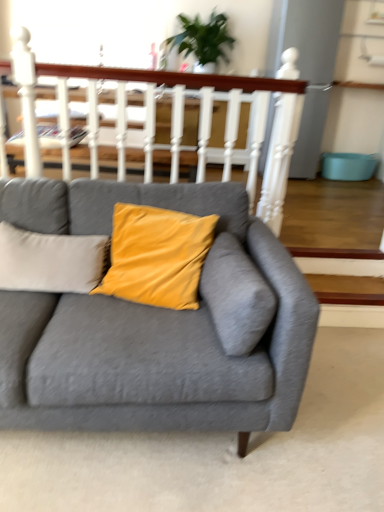
Describe the element at coordinates (149, 330) in the screenshot. I see `matte gray couch at center` at that location.

Describe the element at coordinates (51, 261) in the screenshot. I see `velvet yellow pillow at center` at that location.

In order to click on green leafy plant at upper center in this screenshot , I will do `click(203, 40)`.

This screenshot has width=384, height=512. Find the location of `matte gray couch at center`. matte gray couch at center is located at coordinates (149, 330).

Identify the location of studio couch located on the left of green leafy plant at upper center. (149, 330).

Would you say green leafy plant at upper center is outside matte gray couch at center?

Yes.

Which of these two, green leafy plant at upper center or matte gray couch at center, stands shorter?

green leafy plant at upper center.

From a real-world perspective, which object rests below the other?

matte gray couch at center, from a real-world perspective.

Is point (64, 276) behind point (218, 93)?

That is False.

Consider the image. Is velvet yellow pillow at center far from white wooden balustrade at upper center?

No, velvet yellow pillow at center is not far from white wooden balustrade at upper center.

Does velvet yellow pillow at center appear on the right side of white wooden balustrade at upper center?

Incorrect, velvet yellow pillow at center is not on the right side of white wooden balustrade at upper center.

Considering the positions of point (232, 425) and point (19, 52), is point (232, 425) closer or farther from the camera than point (19, 52)?

Point (232, 425).

Who is bigger, matte gray couch at center or white wooden balustrade at upper center?

matte gray couch at center is bigger.

Could you tell me if matte gray couch at center is facing white wooden balustrade at upper center?

No, matte gray couch at center is not oriented towards white wooden balustrade at upper center.

Does matte gray couch at center appear on the right side of white wooden balustrade at upper center?

Incorrect, matte gray couch at center is not on the right side of white wooden balustrade at upper center.

Is white wooden balustrade at upper center at the back of green leafy plant at upper center?

No, green leafy plant at upper center's orientation is not away from white wooden balustrade at upper center.

What's the angular difference between green leafy plant at upper center and white wooden balustrade at upper center's facing directions?

green leafy plant at upper center and white wooden balustrade at upper center are facing 179 degrees away from each other.

Looking at their sizes, would you say green leafy plant at upper center is wider or thinner than white wooden balustrade at upper center?

In the image, green leafy plant at upper center appears to be wider than white wooden balustrade at upper center.

Considering the relative sizes of matte gray couch at center and velvet yellow pillow at center in the image provided, is matte gray couch at center taller than velvet yellow pillow at center?

Correct, matte gray couch at center is much taller as velvet yellow pillow at center.

From a real-world perspective, between matte gray couch at center and velvet yellow pillow at center, who is vertically lower?

In real-world perspective, matte gray couch at center is lower.

Based on the photo, is matte gray couch at center beside velvet yellow pillow at center?

matte gray couch at center and velvet yellow pillow at center are clearly separated.

In the scene shown: Between matte gray couch at center and velvet yellow pillow at center, which one has larger width?

Wider between the two is matte gray couch at center.

Do you think velvet yellow pillow at center is within matte gray couch at center, or outside of it?

velvet yellow pillow at center exists entirely within matte gray couch at center.

Considering the positions of objects velvet yellow pillow at center and matte gray couch at center in the image provided, who is more to the left, velvet yellow pillow at center or matte gray couch at center?

velvet yellow pillow at center.

Is white wooden balustrade at upper center positioned with its back to velvet yellow pillow at center?

Absolutely, white wooden balustrade at upper center is directed away from velvet yellow pillow at center.

Considering the positions of objects white wooden balustrade at upper center and velvet yellow pillow at center in the image provided, who is behind, white wooden balustrade at upper center or velvet yellow pillow at center?

white wooden balustrade at upper center is behind.

Based on the photo, from their relative heights in the image, would you say white wooden balustrade at upper center is taller or shorter than velvet yellow pillow at center?

white wooden balustrade at upper center is taller than velvet yellow pillow at center.

Is white wooden balustrade at upper center wider than velvet yellow pillow at center?

In fact, white wooden balustrade at upper center might be narrower than velvet yellow pillow at center.

You are a GUI agent. You are given a task and a screenshot of the screen. Output one action in this format:
    pyautogui.click(x=<x>, y=<y>)
    Task: Click on the houseplant positioned vertically above the matte gray couch at center (from a real-world perspective)
    
    Given the screenshot: What is the action you would take?
    pyautogui.click(x=203, y=40)

This screenshot has width=384, height=512. Find the location of `balustrade behind the velvet yellow pillow at center`. balustrade behind the velvet yellow pillow at center is located at coordinates (168, 119).

Which object lies nearer to the anchor point white wooden balustrade at upper center, green leafy plant at upper center or velvet yellow pillow at center?

Based on the image, velvet yellow pillow at center appears to be nearer to white wooden balustrade at upper center.

Considering their positions, is white wooden balustrade at upper center positioned further to matte gray couch at center than velvet yellow pillow at center?

white wooden balustrade at upper center.

Considering their positions, is white wooden balustrade at upper center positioned further to velvet yellow pillow at center than green leafy plant at upper center?

green leafy plant at upper center.

Considering their positions, is velvet yellow pillow at center positioned further to matte gray couch at center than white wooden balustrade at upper center?

white wooden balustrade at upper center.

From the image, which object appears to be nearer to white wooden balustrade at upper center, matte gray couch at center or velvet yellow pillow at center?

matte gray couch at center is positioned closer to the anchor white wooden balustrade at upper center.

Estimate the real-world distances between objects in this image. Which object is closer to velvet yellow pillow at center, white wooden balustrade at upper center or matte gray couch at center?

matte gray couch at center is closer to velvet yellow pillow at center.

Looking at the image, which one is located closer to matte gray couch at center, white wooden balustrade at upper center or green leafy plant at upper center?

white wooden balustrade at upper center.

Which object lies further to the anchor point green leafy plant at upper center, matte gray couch at center or white wooden balustrade at upper center?

Based on the image, matte gray couch at center appears to be further to green leafy plant at upper center.

Locate an element on the screen. The height and width of the screenshot is (512, 384). balustrade between matte gray couch at center and green leafy plant at upper center in the front-back direction is located at coordinates (168, 119).

Locate an element on the screen. pillow between white wooden balustrade at upper center and matte gray couch at center in the up-down direction is located at coordinates (51, 261).

Locate an element on the screen. balustrade located between velvet yellow pillow at center and green leafy plant at upper center in the depth direction is located at coordinates (168, 119).

Locate an element on the screen. The image size is (384, 512). pillow positioned between matte gray couch at center and green leafy plant at upper center from near to far is located at coordinates coord(51,261).